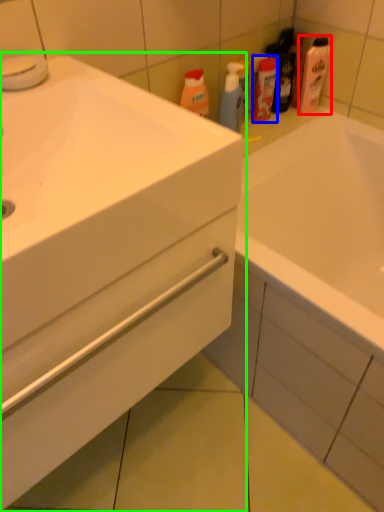
Question: Based on their relative distances, which object is farther from cleaning product (highlighted by a red box)? Choose from mouthwash (highlighted by a blue box) and bathroom cabinet (highlighted by a green box).

Choices:
 (A) mouthwash
 (B) bathroom cabinet

Answer: (B)